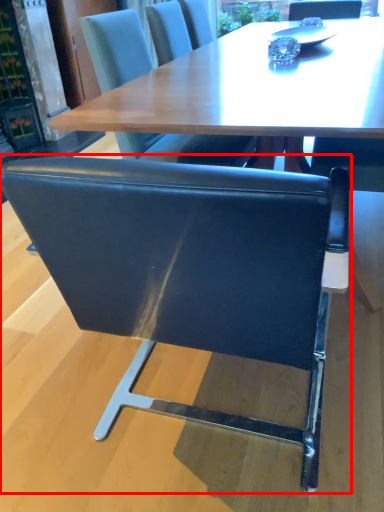
Question: From the image's perspective, what is the correct spatial relationship of chair (annotated by the red box) in relation to chair?

Choices:
 (A) below
 (B) above

Answer: (A)